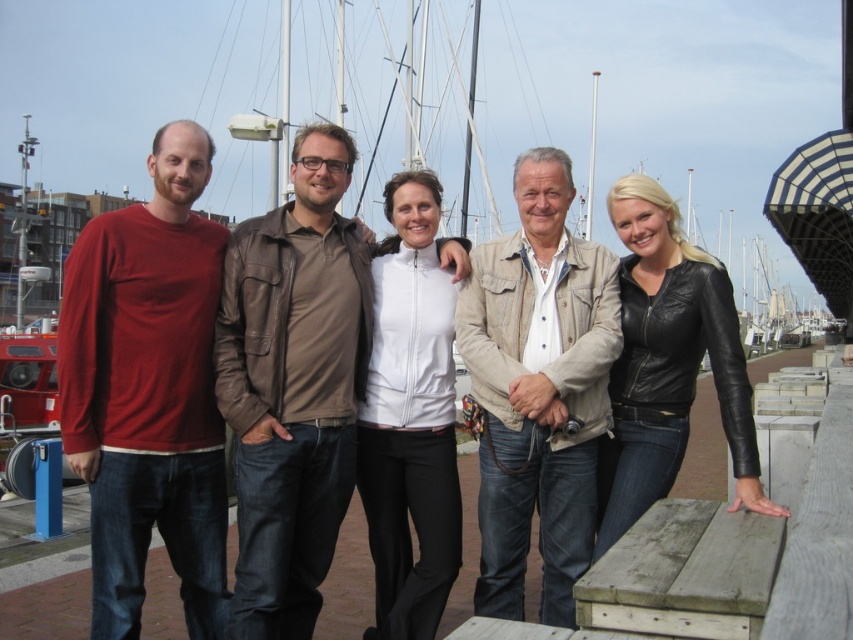
You are trying to determine which item is taller between the matte black jacket at left and the matte red shirt at left. Based on the scene description, which one is taller?

The matte black jacket at left is taller than the matte red shirt at left according to the description.